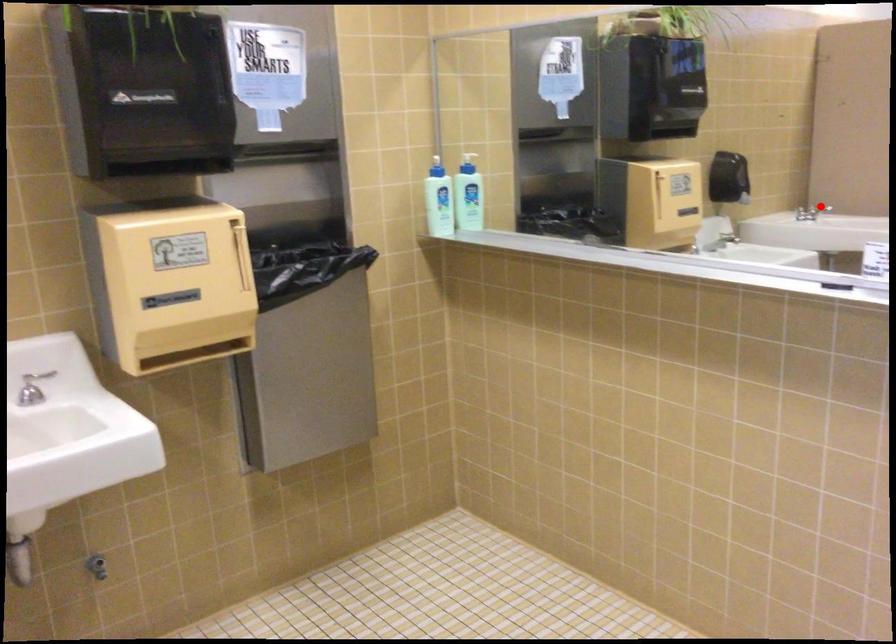
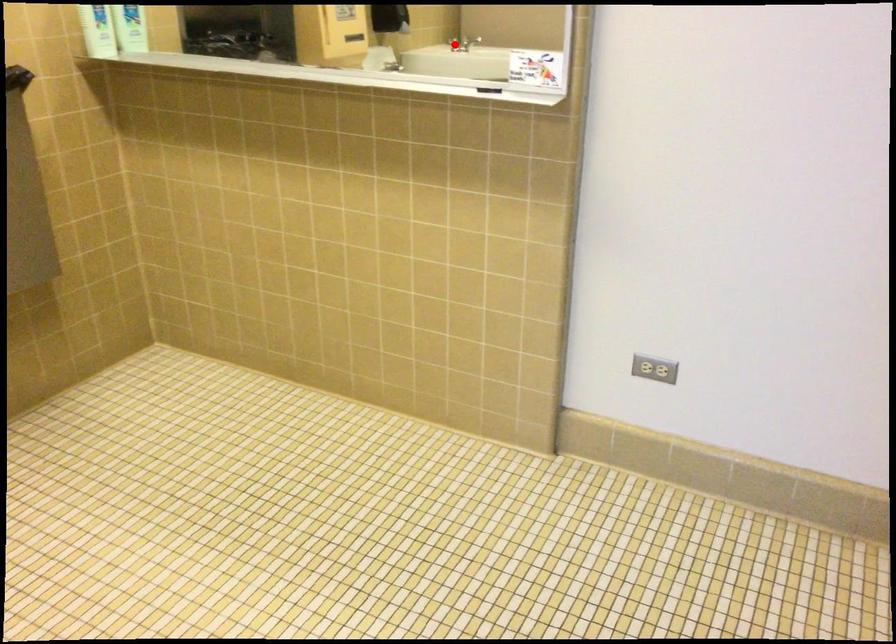
I am providing you with two images of the same scene from different viewpoints. A red point is marked on the first image and another point is marked on the second image. Does the point marked in image1 correspond to the same location as the one in image2?

No